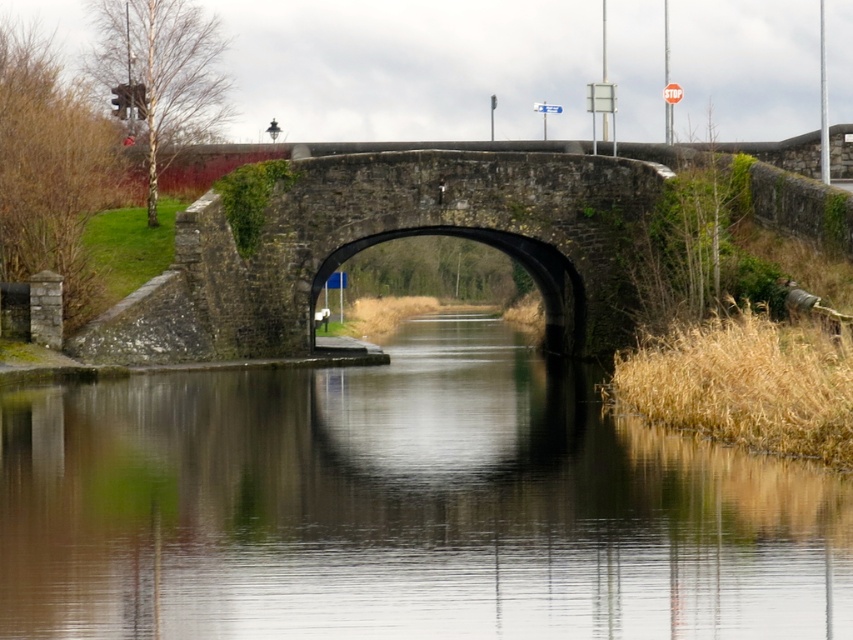
Is smooth brown water at center smaller than stone arch bridge at center?

Actually, smooth brown water at center might be larger than stone arch bridge at center.

Between smooth brown water at center and stone arch bridge at center, which one is positioned lower?

smooth brown water at center is lower down.

Which is behind, point (138, 628) or point (508, 216)?

Positioned behind is point (508, 216).

The image size is (853, 640). In order to click on smooth brown water at center in this screenshot , I will do `click(402, 508)`.